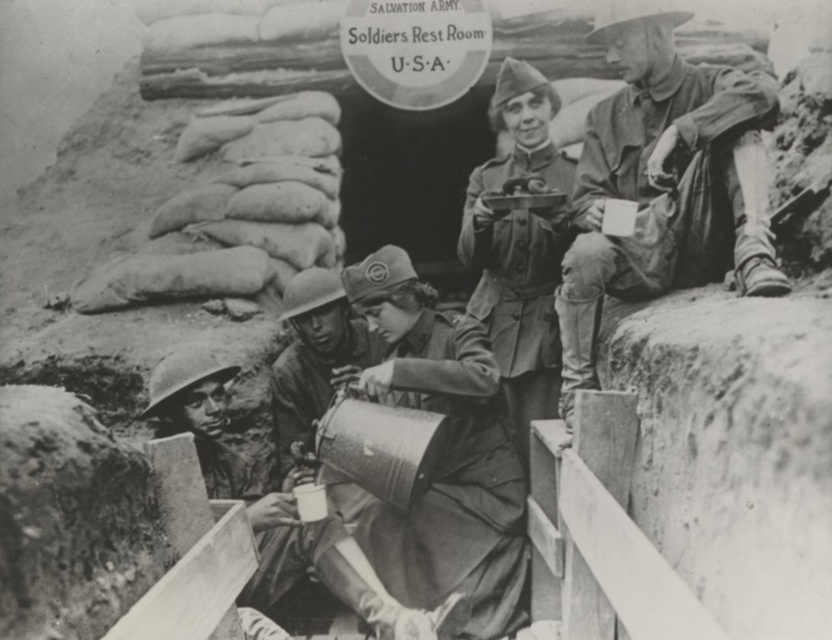
Can you confirm if matte brown uniform at center is shorter than matte khaki uniform at center?

Correct, matte brown uniform at center is not as tall as matte khaki uniform at center.

This screenshot has width=832, height=640. Find the location of `matte brown uniform at center`. matte brown uniform at center is located at coordinates (442, 454).

Which is above, matte metal helmet at lower left or metallic helmet at center?

Positioned higher is metallic helmet at center.

You are a GUI agent. You are given a task and a screenshot of the screen. Output one action in this format:
    pyautogui.click(x=<x>, y=<y>)
    Task: Click on the matte metal helmet at lower left
    The width and height of the screenshot is (832, 640).
    Given the screenshot: What is the action you would take?
    [318, 564]

Does point (598, 140) lie behind point (484, 228)?

No, (598, 140) is closer to viewer.

What do you see at coordinates (657, 182) in the screenshot? I see `rugged leather jacket at upper right` at bounding box center [657, 182].

Between point (686, 275) and point (547, 380), which one is positioned behind?

Point (547, 380)

The height and width of the screenshot is (640, 832). I want to click on rugged leather jacket at upper right, so click(x=657, y=182).